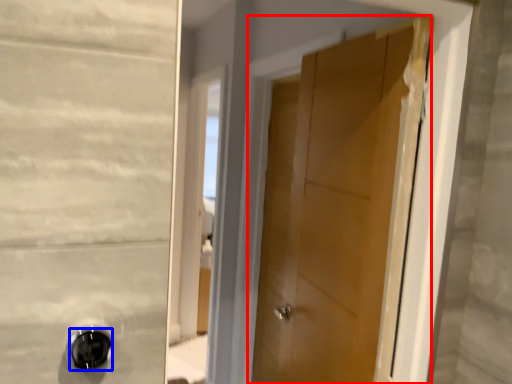
Question: Which of the following is the farthest to the observer, door (highlighted by a red box) or door handle (highlighted by a blue box)?

Choices:
 (A) door
 (B) door handle

Answer: (A)